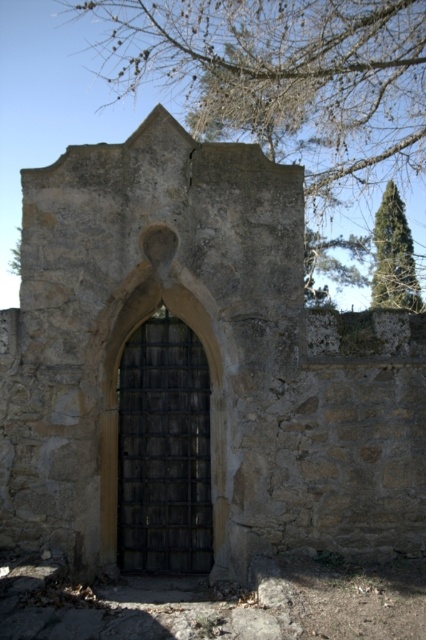
Based on the photo, can you confirm if bare branches at upper center is positioned below dark brown wooden door at center?

Incorrect, bare branches at upper center is not positioned below dark brown wooden door at center.

Does bare branches at upper center have a greater width compared to dark brown wooden door at center?

Indeed, bare branches at upper center has a greater width compared to dark brown wooden door at center.

Image resolution: width=426 pixels, height=640 pixels. What do you see at coordinates (284, 77) in the screenshot? I see `bare branches at upper center` at bounding box center [284, 77].

Where is `bare branches at upper center`? This screenshot has width=426, height=640. bare branches at upper center is located at coordinates (284, 77).

Can you confirm if dark brown wooden door at center is smaller than green coniferous tree at upper right?

Yes, dark brown wooden door at center is smaller than green coniferous tree at upper right.

Where is `dark brown wooden door at center`? The height and width of the screenshot is (640, 426). dark brown wooden door at center is located at coordinates (164, 451).

Between bare branches at upper center and green coniferous tree at upper right, which one is positioned lower?

green coniferous tree at upper right

Between bare branches at upper center and green coniferous tree at upper right, which one has less height?

With less height is green coniferous tree at upper right.

Where is `bare branches at upper center`? The width and height of the screenshot is (426, 640). bare branches at upper center is located at coordinates (284, 77).